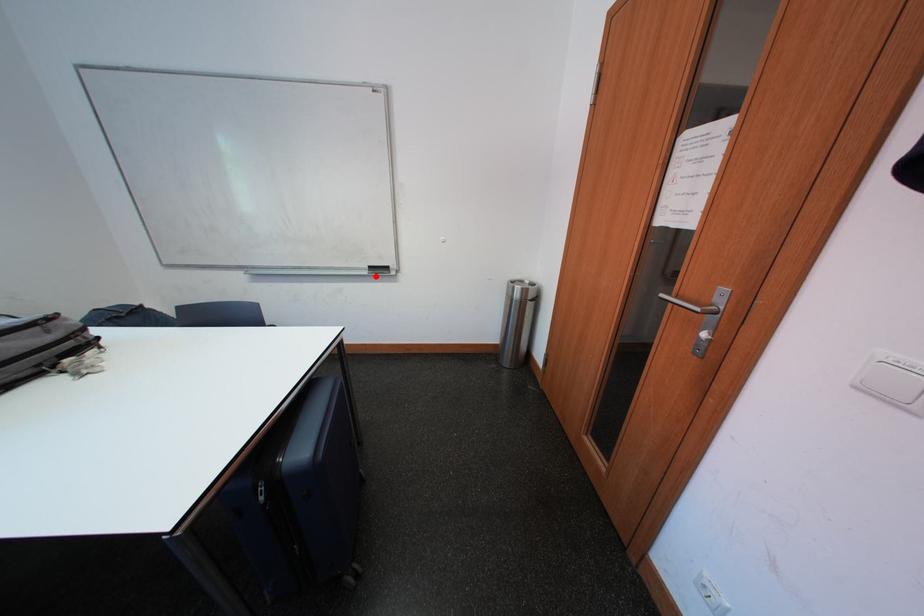
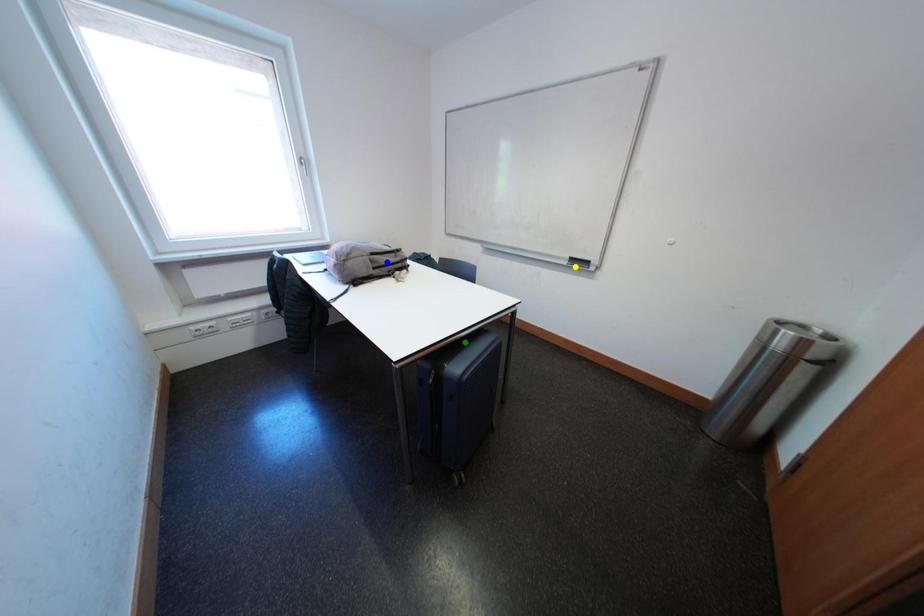
Question: I am providing you with two images of the same scene from different viewpoints. A red point is marked on the first image. You are given multiple points on the second image. Which spot in image 2 lines up with the point in image 1?

Choices:
 (A) green point
 (B) blue point
 (C) yellow point

Answer: (C)